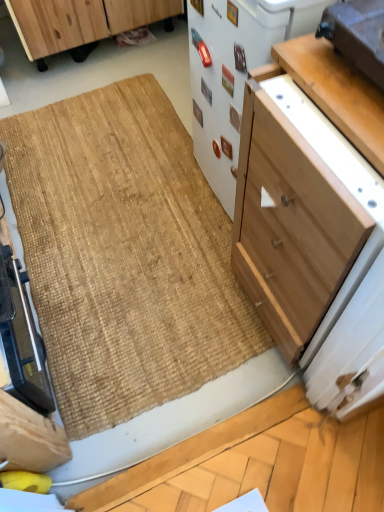
Question: From a real-world perspective, is matte brown toaster at upper right, which appears as the 1th appliance when viewed from the right, above or below white matte refrigerator at center, which is counted as the 2th appliance, starting from the left?

Choices:
 (A) below
 (B) above

Answer: (B)

Question: From the image's perspective, is matte brown toaster at upper right, the third appliance in the left-to-right sequence, positioned above or below white matte refrigerator at center, acting as the second appliance starting from the right?

Choices:
 (A) above
 (B) below

Answer: (B)

Question: Which of these objects is positioned closest to the light wood cabinet at center-right, the first cabinetry viewed from the right?

Choices:
 (A) wooden cabinet at upper left, positioned as the first cabinetry in left-to-right order
 (B) white matte refrigerator at center, which is counted as the 2th appliance, starting from the left
 (C) metallic silver toaster at lower left, placed as the third appliance when sorted from right to left
 (D) natural fiber doormat at center
 (E) matte brown toaster at upper right, the third appliance in the left-to-right sequence

Answer: (B)

Question: Estimate the real-world distances between objects in this image. Which object is closer to the light brown wood drawer at upper right?

Choices:
 (A) matte brown toaster at upper right, the third appliance in the left-to-right sequence
 (B) white matte refrigerator at center, which is counted as the 2th appliance, starting from the left
 (C) wooden cabinet at upper left, the 2th cabinetry in the front-to-back sequence
 (D) natural fiber doormat at center
 (E) metallic silver toaster at lower left, placed as the third appliance when sorted from right to left

Answer: (A)